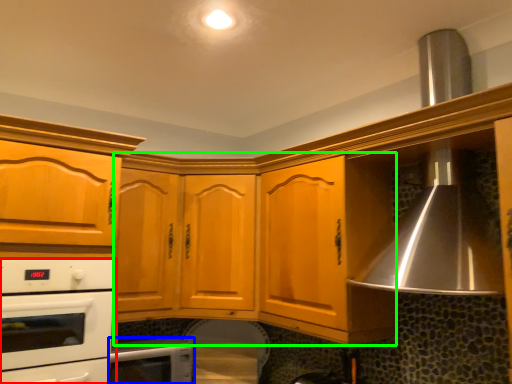
Question: Which is nearer to the home appliance (highlighted by a red box)? home appliance (highlighted by a blue box) or cabinetry (highlighted by a green box).

Choices:
 (A) home appliance
 (B) cabinetry

Answer: (A)